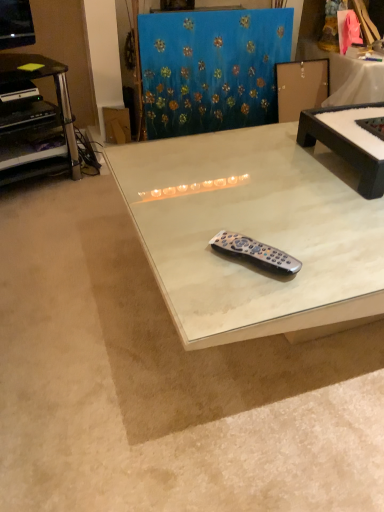
Question: Is black plastic desk at left thinner than blue textured fabric at upper center?

Choices:
 (A) no
 (B) yes

Answer: (A)

Question: Is black plastic desk at left further to the viewer compared to blue textured fabric at upper center?

Choices:
 (A) no
 (B) yes

Answer: (A)

Question: Does black plastic desk at left have a greater height compared to blue textured fabric at upper center?

Choices:
 (A) yes
 (B) no

Answer: (B)

Question: Can you confirm if black plastic desk at left is positioned to the left of blue textured fabric at upper center?

Choices:
 (A) yes
 (B) no

Answer: (A)

Question: Would you say black plastic desk at left contains blue textured fabric at upper center?

Choices:
 (A) yes
 (B) no

Answer: (B)

Question: From the image's perspective, is cardboard at upper left above or below white marble table at center, the second table from the right?

Choices:
 (A) below
 (B) above

Answer: (B)

Question: From a real-world perspective, is cardboard at upper left above or below white marble table at center, the 1th table positioned from the left?

Choices:
 (A) above
 (B) below

Answer: (B)

Question: In terms of size, does cardboard at upper left appear bigger or smaller than white marble table at center, the second table from the right?

Choices:
 (A) big
 (B) small

Answer: (B)

Question: Considering the positions of point (107, 136) and point (372, 231), is point (107, 136) closer or farther from the camera than point (372, 231)?

Choices:
 (A) farther
 (B) closer

Answer: (A)

Question: From the image's perspective, is white marble table at center, the 1th table positioned from the left, located above or below cardboard at upper left?

Choices:
 (A) below
 (B) above

Answer: (A)

Question: Based on their positions, is white marble table at center, the second table from the right, located to the left or right of cardboard at upper left?

Choices:
 (A) right
 (B) left

Answer: (A)

Question: Based on their sizes in the image, would you say white marble table at center, the second table from the right, is bigger or smaller than cardboard at upper left?

Choices:
 (A) big
 (B) small

Answer: (A)

Question: From a real-world perspective, relative to cardboard at upper left, is white marble table at center, the 1th table positioned from the left, vertically above or below?

Choices:
 (A) below
 (B) above

Answer: (B)

Question: From the image's perspective, is black plastic desk at left positioned above or below blue textured fabric at upper center?

Choices:
 (A) below
 (B) above

Answer: (A)

Question: Relative to blue textured fabric at upper center, is black plastic desk at left in front or behind?

Choices:
 (A) behind
 (B) front

Answer: (B)